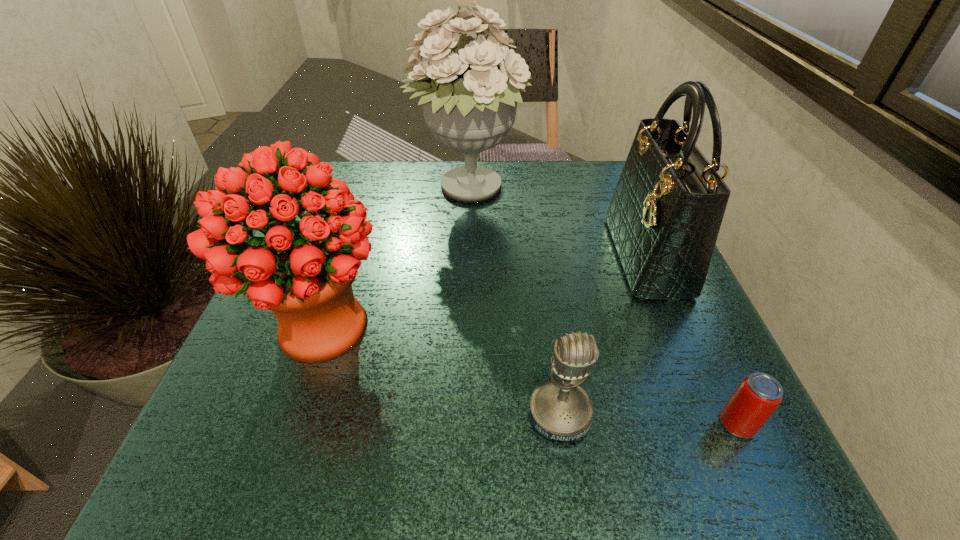
I want to click on the farther bouquet, so click(470, 108).

Where is `the tallest object`? This screenshot has width=960, height=540. the tallest object is located at coordinates (470, 108).

Locate an element on the screen. Image resolution: width=960 pixels, height=540 pixels. handbag is located at coordinates (665, 214).

The image size is (960, 540). Identify the location of the nearer bouquet. (303, 271).

Where is `the fourth tallest object`? the fourth tallest object is located at coordinates (561, 410).

Where is `beer can`? This screenshot has height=540, width=960. beer can is located at coordinates (756, 398).

This screenshot has width=960, height=540. Find the location of `vacant space situated 0.160m on the right of the farther bouquet`. vacant space situated 0.160m on the right of the farther bouquet is located at coordinates (590, 191).

Image resolution: width=960 pixels, height=540 pixels. Identify the location of vacant space located at the front of the handbag with visible charms. (x=541, y=256).

Locate an element on the screen. The height and width of the screenshot is (540, 960). free space located 0.130m at the front of the handbag with visible charms is located at coordinates (551, 256).

Where is `free spot located at the front of the handbag with visible charms`? This screenshot has height=540, width=960. free spot located at the front of the handbag with visible charms is located at coordinates (571, 256).